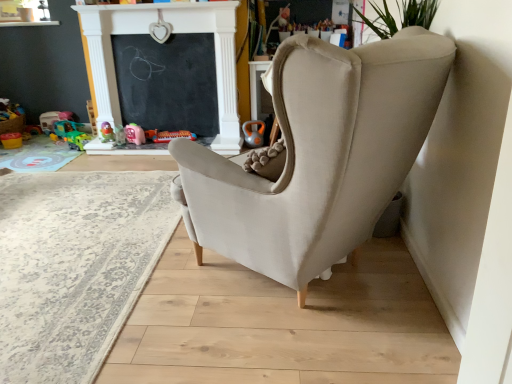
Question: In terms of height, does translucent plastic toy at lower left, which ranks as the 2th toy in left-to-right order, look taller or shorter compared to plastic green toy car at center, which is the fifth toy in right-to-left order?

Choices:
 (A) short
 (B) tall

Answer: (B)

Question: From the image's perspective, relative to plastic green toy car at center, which is the fifth toy in right-to-left order, is translucent plastic toy at lower left, which ranks as the 2th toy in left-to-right order, above or below?

Choices:
 (A) above
 (B) below

Answer: (A)

Question: Which is nearer to the matte pink plastic toy at center, the third toy in the right-to-left sequence?

Choices:
 (A) matte plastic toy at center, marked as the 4th toy in a left-to-right arrangement
 (B) black chalkboard at upper center
 (C) beige fabric rug at lower left
 (D) matte plastic kettlebell at center, arranged as the 7th toy when viewed from the left
 (E) plastic green toy car at center, which is the fifth toy in right-to-left order

Answer: (A)

Question: Estimate the real-world distances between objects in this image. Which object is closer to the matte pink plastic toy at center, which ranks as the fifth toy in left-to-right order?

Choices:
 (A) black chalkboard at upper center
 (B) plastic green toy car at center, which is the fifth toy in right-to-left order
 (C) plastic/toy琴 at center, which appears as the sixth toy when viewed from the left
 (D) matte plastic kettlebell at center, arranged as the 7th toy when viewed from the left
 (E) translucent plastic toy at lower left, the 6th toy when ordered from right to left

Answer: (C)